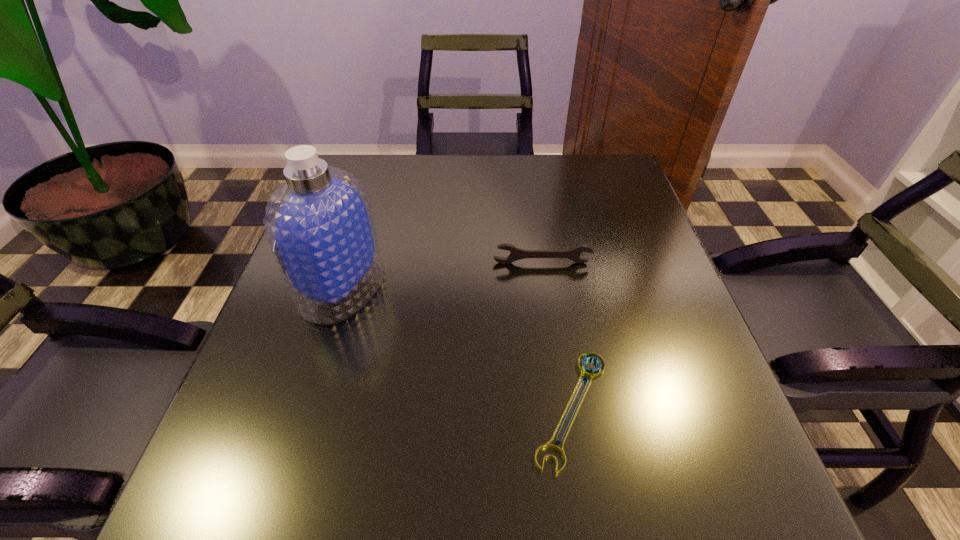
Identify the location of the tallest object. The image size is (960, 540). (319, 224).

Identify the location of the leftmost object. The height and width of the screenshot is (540, 960). (319, 224).

This screenshot has height=540, width=960. In order to click on the taller wrench in this screenshot , I will do `click(516, 254)`.

The image size is (960, 540). What are the coordinates of `the farther wrench` in the screenshot? It's located at (516, 254).

At what (x,y) coordinates should I click in order to perform the action: click on the shortest object. Please return your answer as a coordinate pair (x, y). Looking at the image, I should click on (589, 372).

This screenshot has width=960, height=540. Find the location of `the nearest object`. the nearest object is located at coordinates pos(589,372).

Where is `free space located on the back of the cleansing agent`? The image size is (960, 540). free space located on the back of the cleansing agent is located at coordinates (361, 228).

At what (x,y) coordinates should I click in order to perform the action: click on vacant position located 0.370m on the open ends of the farther wrench. Please return your answer as a coordinate pair (x, y). Looking at the image, I should click on (564, 417).

This screenshot has height=540, width=960. Identify the location of blank area located 0.390m on the back of the nearer wrench. (542, 224).

Image resolution: width=960 pixels, height=540 pixels. I want to click on object at the near edge, so [589, 372].